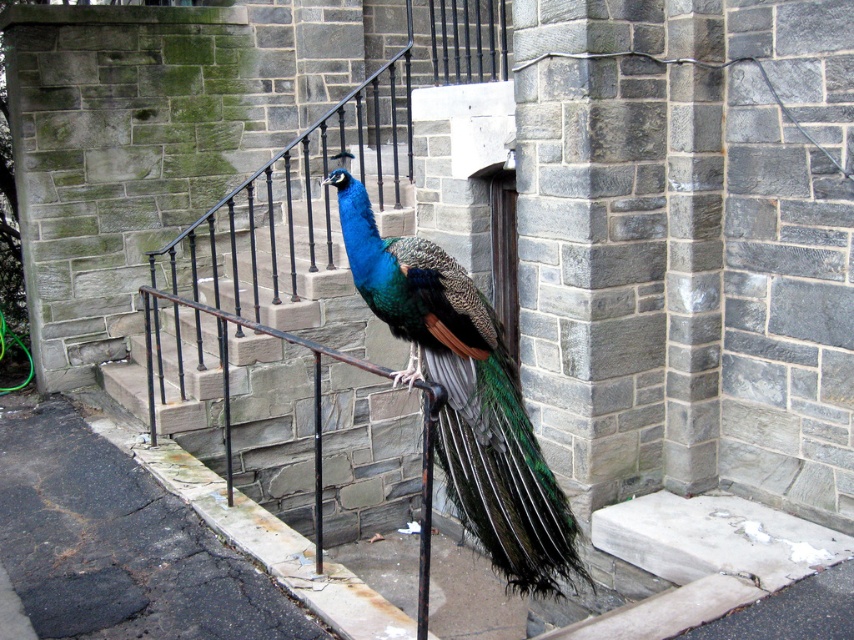
Question: Does shiny blue peacock at center appear under gray stone stairs at center?

Choices:
 (A) no
 (B) yes

Answer: (B)

Question: Can you confirm if shiny blue peacock at center is wider than gray stone stairs at center?

Choices:
 (A) yes
 (B) no

Answer: (B)

Question: Which point appears farthest from the camera in this image?

Choices:
 (A) (331, 305)
 (B) (507, 461)

Answer: (A)

Question: Which object appears farthest from the camera in this image?

Choices:
 (A) gray stone stairs at center
 (B) shiny blue peacock at center

Answer: (A)

Question: Observing the image, what is the correct spatial positioning of shiny blue peacock at center in reference to gray stone stairs at center?

Choices:
 (A) right
 (B) left

Answer: (A)